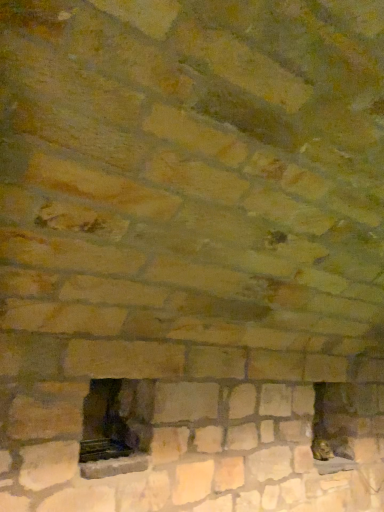
Describe the element at coordinates (322, 449) in the screenshot. The width and height of the screenshot is (384, 512). I see `shiny metallic animal at lower right` at that location.

What is the approximate height of shiny metallic animal at lower right?

shiny metallic animal at lower right is 6.26 inches tall.

The image size is (384, 512). Find the location of `shiny metallic animal at lower right`. shiny metallic animal at lower right is located at coordinates (322, 449).

Find the location of `shiny metallic animal at lower right`. shiny metallic animal at lower right is located at coordinates (322, 449).